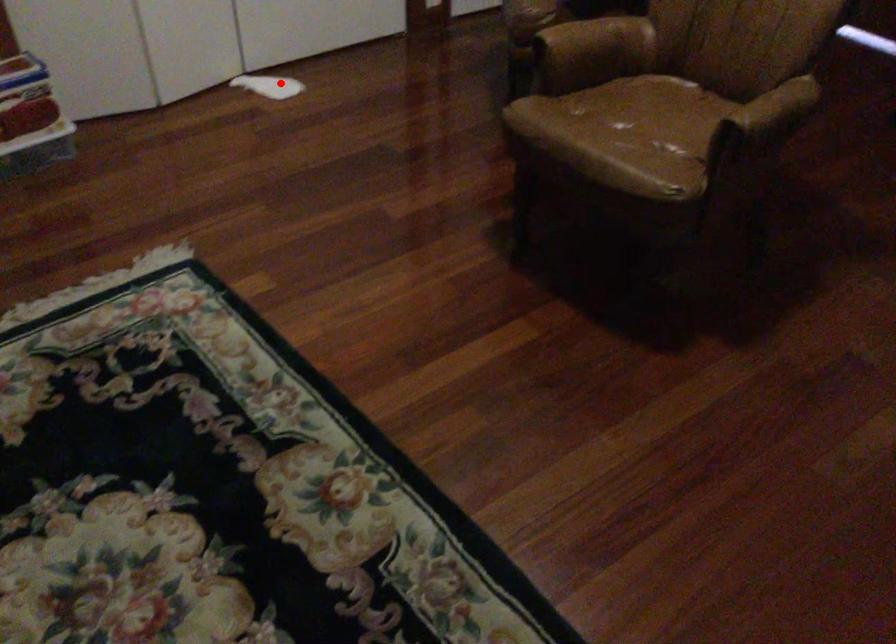
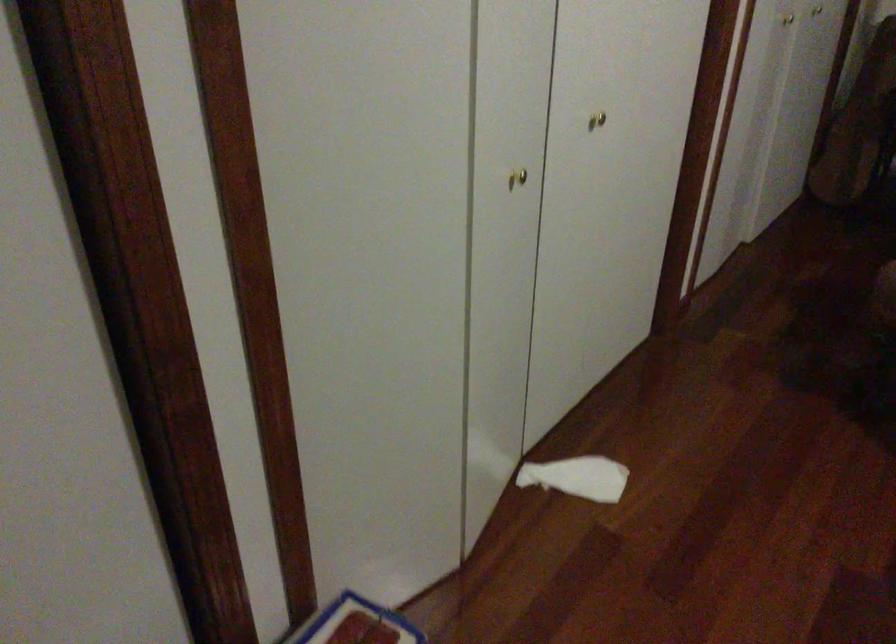
Question: I am providing you with two images of the same scene from different viewpoints. A red point is shown in image1. For the corresponding object point in image2, is it positioned nearer or farther from the camera?

Choices:
 (A) Nearer
 (B) Farther

Answer: (A)